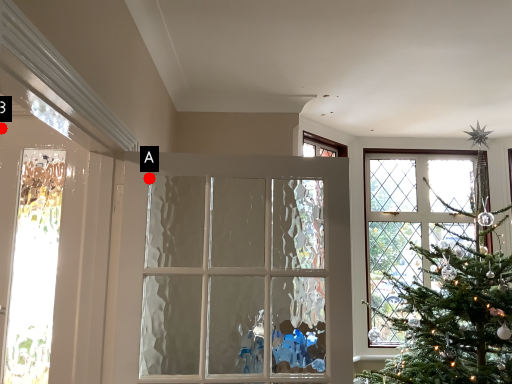
Question: Two points are circled on the image, labeled by A and B beside each circle. Among these points, which one is nearest to the camera?

Choices:
 (A) A is closer
 (B) B is closer

Answer: (A)